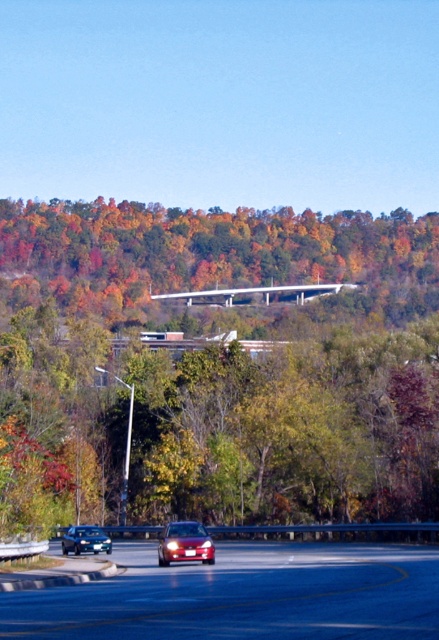
Which is in front, point (213, 598) or point (79, 531)?

Point (213, 598) is more forward.

Who is more forward, (x=402, y=572) or (x=82, y=536)?

Positioned in front is point (x=402, y=572).

Locate an element on the screen. This screenshot has height=640, width=439. shiny black car at center is located at coordinates (243, 595).

Is green leafy tree at center smaller than shiny black car at center?

No, green leafy tree at center is not smaller than shiny black car at center.

Find the location of a particular element. green leafy tree at center is located at coordinates [x=218, y=365].

Is shiny red car at center behind shiny black sedan at lower left?

No, shiny red car at center is closer to the viewer.

Does shiny red car at center have a larger size compared to shiny black sedan at lower left?

Indeed, shiny red car at center has a larger size compared to shiny black sedan at lower left.

Which is in front, point (161, 552) or point (64, 552)?

Point (161, 552)

The height and width of the screenshot is (640, 439). I want to click on shiny red car at center, so click(x=184, y=544).